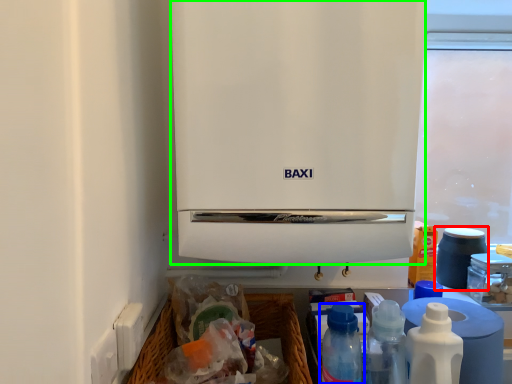
Question: Which is farther away from appliance (highlighted by a red box)? bottle (highlighted by a blue box) or home appliance (highlighted by a green box)?

Choices:
 (A) bottle
 (B) home appliance

Answer: (B)